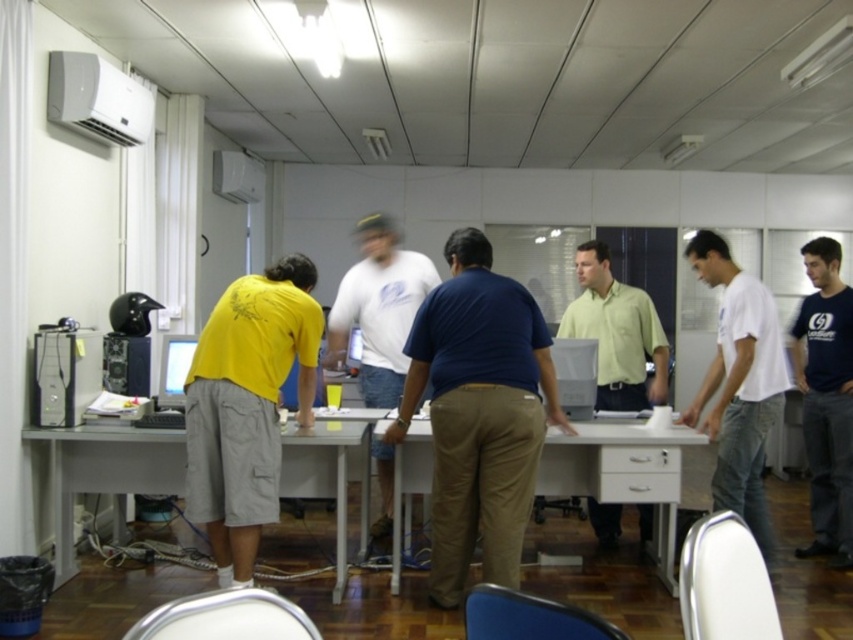
Question: Is dark blue t-shirt at right positioned before light green shirt at center?

Choices:
 (A) no
 (B) yes

Answer: (A)

Question: Which of the following is the farthest from the observer?

Choices:
 (A) (741, 502)
 (B) (485, 289)
 (C) (184, 433)

Answer: (A)

Question: Considering the relative positions of white cotton shirt at right and light green shirt at center in the image provided, where is white cotton shirt at right located with respect to light green shirt at center?

Choices:
 (A) left
 (B) right

Answer: (B)

Question: Is white cotton shirt at right bigger than white glossy table at center?

Choices:
 (A) no
 (B) yes

Answer: (B)

Question: Which is nearer to the satin silver monitor at center?

Choices:
 (A) black plastic tower at left
 (B) white plastic table at lower left

Answer: (B)

Question: Which object appears farthest from the camera in this image?

Choices:
 (A) light green shirt at center
 (B) white glossy table at center
 (C) white plastic table at lower left
 (D) matte blue shirt at center

Answer: (A)